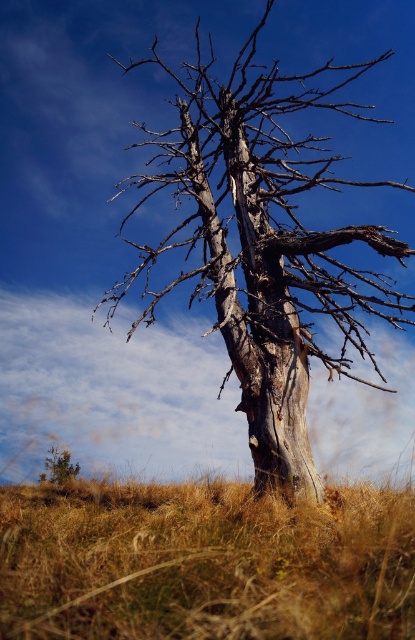
Between gray textured tree at center and brown textured bush at lower left, which one has more height?

gray textured tree at center

Is gray textured tree at center to the left of brown textured bush at lower left from the viewer's perspective?

Incorrect, gray textured tree at center is not on the left side of brown textured bush at lower left.

You are a GUI agent. You are given a task and a screenshot of the screen. Output one action in this format:
    pyautogui.click(x=<x>, y=<y>)
    Task: Click on the gray textured tree at center
    This screenshot has height=640, width=415.
    Given the screenshot: What is the action you would take?
    pyautogui.click(x=263, y=243)

Does dry grass at lower center have a greater height compared to gray textured tree at center?

No.

Is point (402, 564) closer to camera compared to point (219, 323)?

Yes, point (402, 564) is closer to viewer.

Locate an element on the screen. Image resolution: width=415 pixels, height=640 pixels. dry grass at lower center is located at coordinates (205, 563).

Who is more forward, (92, 538) or (70, 470)?

Point (92, 538)

Does point (95, 609) come in front of point (65, 468)?

Yes, point (95, 609) is closer to viewer.

What do you see at coordinates (205, 563) in the screenshot? I see `dry grass at lower center` at bounding box center [205, 563].

I want to click on dry grass at lower center, so click(205, 563).